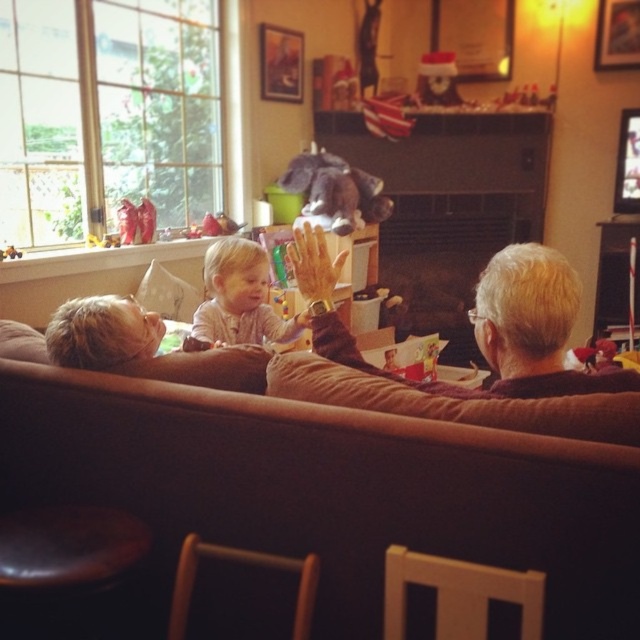
Consider the image. You are a guest arriving at the house and need to sit down. The brown fabric couch at center and the wooden chair at lower center are available. Which one is closer to the large window on the left side?

The brown fabric couch at center is positioned over the wooden chair at lower center, so the brown fabric couch at center is closer to the large window on the left side.

You are trying to place a new rug in the living room. The brown fabric couch at center and the gray fabric couch at center are both in the same area. Which couch should you place the rug under first?

The brown fabric couch at center is located below the gray fabric couch at center, so you should place the rug under the brown fabric couch at center first.